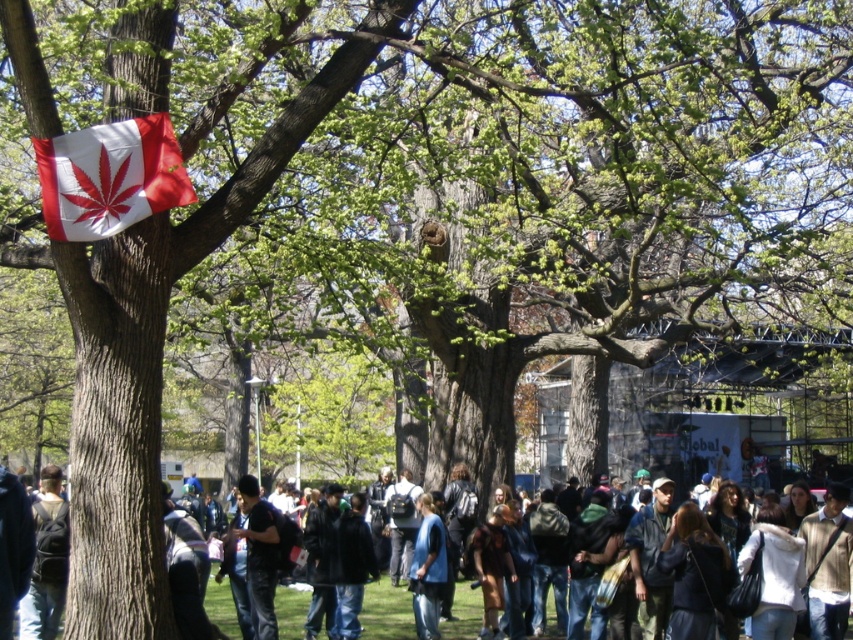
Does point (144, 120) come in front of point (383, 576)?

That is True.

Who is more forward, (51,141) or (364,592)?

Point (51,141) is in front.

At what (x,y) coordinates should I click in order to perform the action: click on white fabric flag at upper left. Please return your answer as a coordinate pair (x, y). Looking at the image, I should click on (109, 177).

Does point (221, 605) come farther from viewer compared to point (32, 504)?

That is True.

Which is below, dark blue jeans at center or dark blue jeans at lower left?

dark blue jeans at center is below.

Identify the location of dark blue jeans at center. (386, 611).

How distant is white fabric flag at upper left from dark gray fabric jacket at center?

The distance of white fabric flag at upper left from dark gray fabric jacket at center is 10.23 meters.

Does white fabric flag at upper left have a lesser width compared to dark gray fabric jacket at center?

No, white fabric flag at upper left is not thinner than dark gray fabric jacket at center.

Locate an element on the screen. Image resolution: width=853 pixels, height=640 pixels. white fabric flag at upper left is located at coordinates (109, 177).